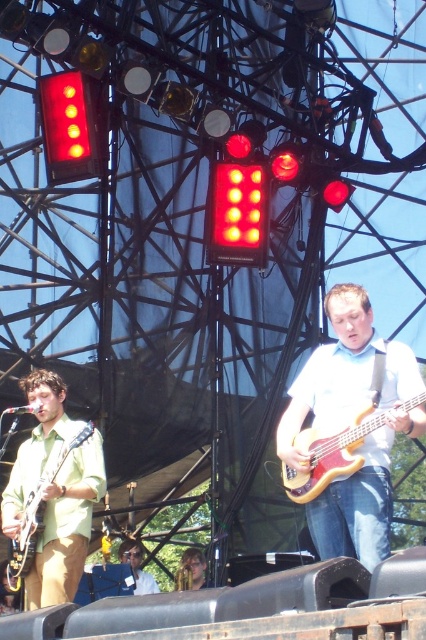
Question: Which object is positioned farthest from the matte white shirt at center?

Choices:
 (A) light brown leather jacket at center
 (B) wooden electric bass at center
 (C) matte green wood guitar at left

Answer: (A)

Question: Which is farther from the light brown leather jacket at center?

Choices:
 (A) matte green wood guitar at left
 (B) matte white shirt at center
 (C) wooden electric bass at center

Answer: (C)

Question: Is matte green wood guitar at left wider than light brown leather jacket at center?

Choices:
 (A) no
 (B) yes

Answer: (B)

Question: Which object is the closest to the matte green wood guitar at left?

Choices:
 (A) wooden electric bass at center
 (B) light brown leather jacket at center
 (C) matte white shirt at center

Answer: (A)

Question: Where is matte white shirt at center located in relation to light brown leather jacket at center in the image?

Choices:
 (A) right
 (B) left

Answer: (A)

Question: Can you confirm if wooden electric bass at center is smaller than matte green wood guitar at left?

Choices:
 (A) no
 (B) yes

Answer: (B)